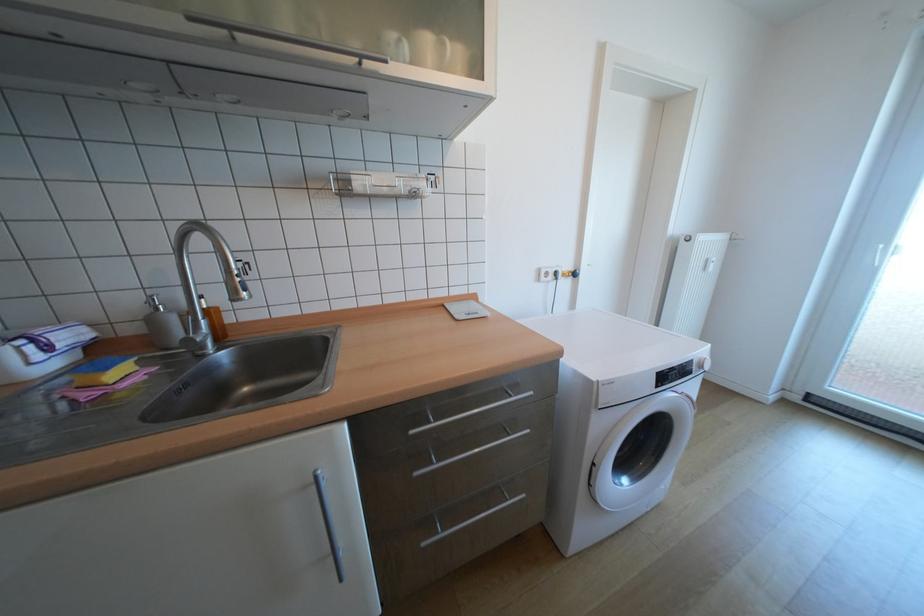
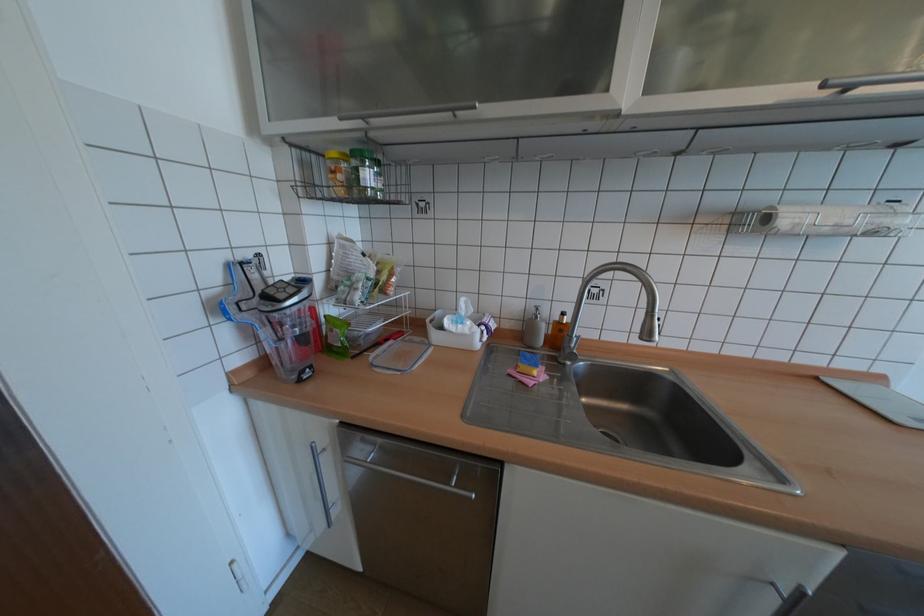
Where in the second image is the point corresponding to (x=166, y=310) from the first image?

(545, 317)